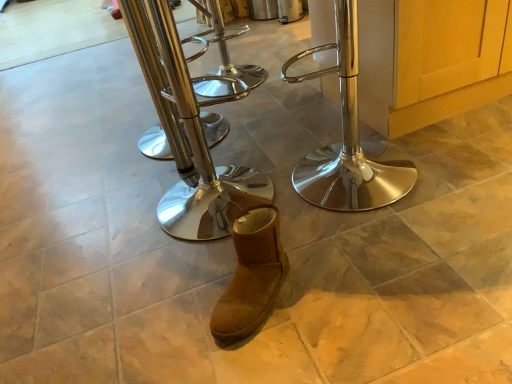
This screenshot has width=512, height=384. I want to click on vacant space that's between polished chrome stool at center, which appears as the 1th step stool when viewed from the right, and brown suede boot at center, so click(308, 242).